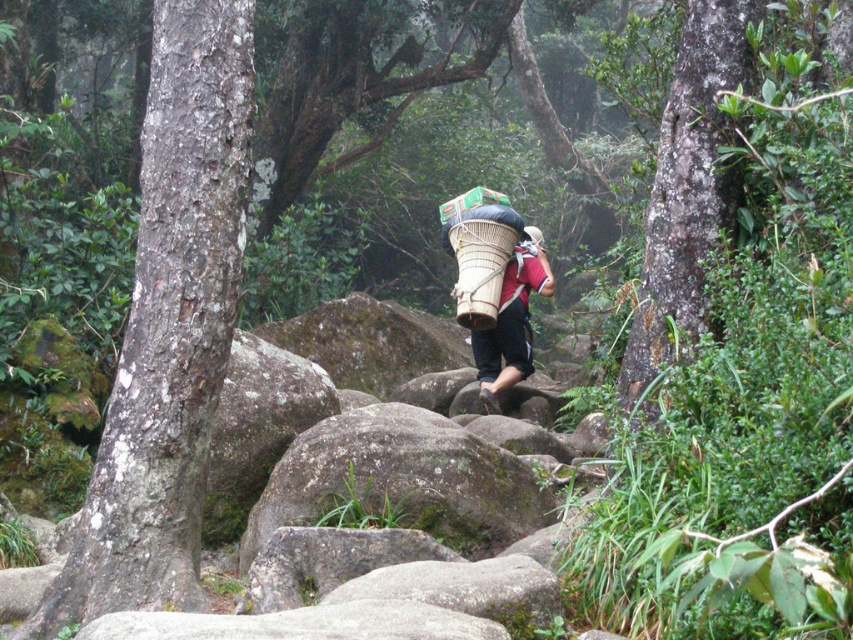
You are planning to place a small flag on top of the green mossy rock at center and the matte brown basket at center. Which object will require you to reach higher?

The matte brown basket at center is taller than the green mossy rock at center, so you will need to reach higher to place the flag on the matte brown basket at center.